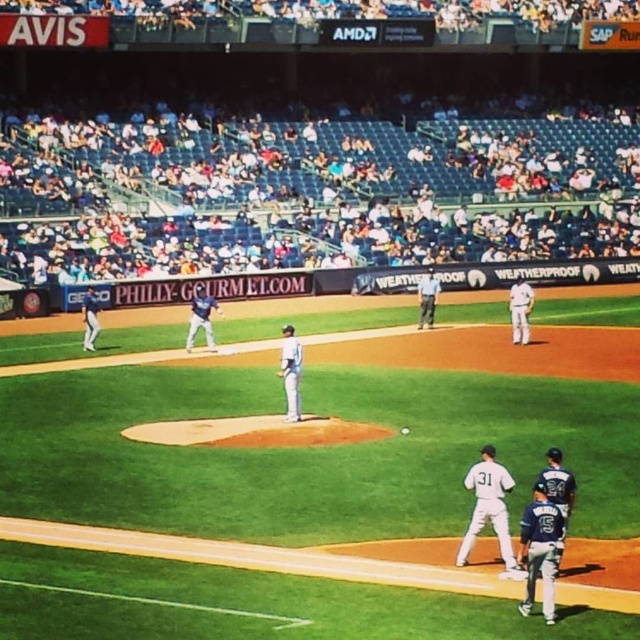
Question: Which of the following is the closest to the observer?

Choices:
 (A) white plastic seats at upper center
 (B) white matte baseball player at lower right

Answer: (B)

Question: Which object is farther from the camera taking this photo?

Choices:
 (A) white plastic seats at upper center
 (B) white matte baseball player at lower right
 (C) blue fabric shirt at center

Answer: (A)

Question: Can you confirm if white matte uniform at lower right is positioned above white matte uniform at center?

Choices:
 (A) no
 (B) yes

Answer: (A)

Question: Which of these objects is positioned farthest from the blue fabric shirt at center?

Choices:
 (A) white plastic seats at upper center
 (B) blue uniform at center
 (C) white matte baseball player at lower right
 (D) white matte uniform at lower right

Answer: (D)

Question: Does white matte uniform at lower right come in front of white matte baseball player at lower right?

Choices:
 (A) no
 (B) yes

Answer: (B)

Question: Does white plastic seats at upper center have a lesser width compared to blue fabric shirt at center?

Choices:
 (A) yes
 (B) no

Answer: (B)